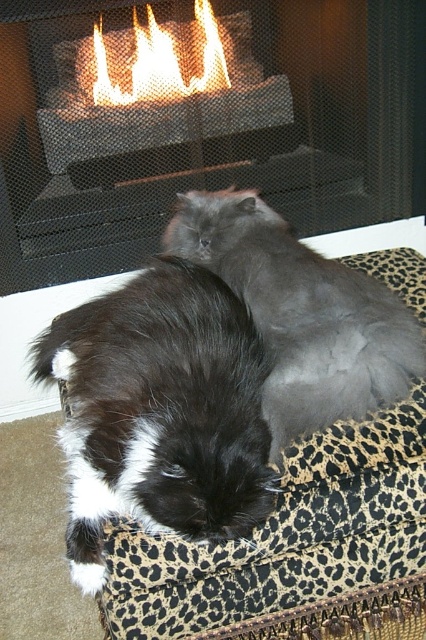
Can you confirm if metallic mesh fireplace at center is bigger than leopard print cushion at center?

Yes, metallic mesh fireplace at center is bigger than leopard print cushion at center.

Is metallic mesh fireplace at center above leopard print cushion at center?

Correct, metallic mesh fireplace at center is located above leopard print cushion at center.

Is point (340, 109) positioned in front of point (371, 580)?

That is False.

Where is `metallic mesh fireplace at center`? metallic mesh fireplace at center is located at coordinates (203, 124).

Can you confirm if leopard print cushion at center is thinner than black fluffy cat at center?

No.

Does leopard print cushion at center lie in front of black fluffy cat at center?

No, it is not.

Describe the element at coordinates (294, 548) in the screenshot. The height and width of the screenshot is (640, 426). I see `leopard print cushion at center` at that location.

You are a GUI agent. You are given a task and a screenshot of the screen. Output one action in this format:
    pyautogui.click(x=<x>, y=<y>)
    Task: Click on the leopard print cushion at center
    This screenshot has height=640, width=426.
    Given the screenshot: What is the action you would take?
    pyautogui.click(x=294, y=548)

Is black fluffy cat at center shorter than gray fluffy cat at center?

In fact, black fluffy cat at center may be taller than gray fluffy cat at center.

What do you see at coordinates (161, 412) in the screenshot? I see `black fluffy cat at center` at bounding box center [161, 412].

Who is more distant from viewer, (219,280) or (281,240)?

Positioned behind is point (281,240).

The image size is (426, 640). What are the coordinates of `black fluffy cat at center` in the screenshot? It's located at (161, 412).